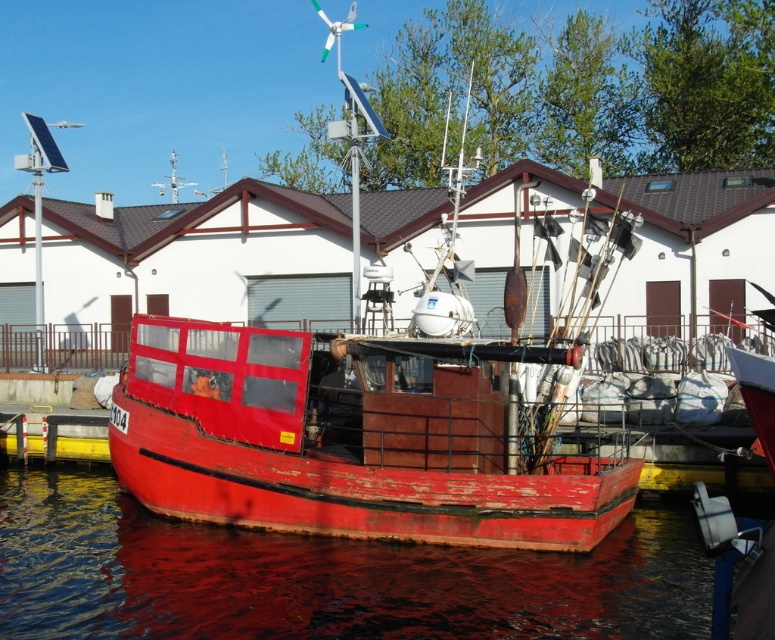
In the scene shown: You are planning to sail a small dinghy that is 2 meters wide. You see the rusty metal boat at center and the smooth red water at lower center in the image. Can your dinghy fit between them?

The rusty metal boat at center is narrower than the smooth red water at lower center, so the dinghy can fit between them as there is sufficient space.